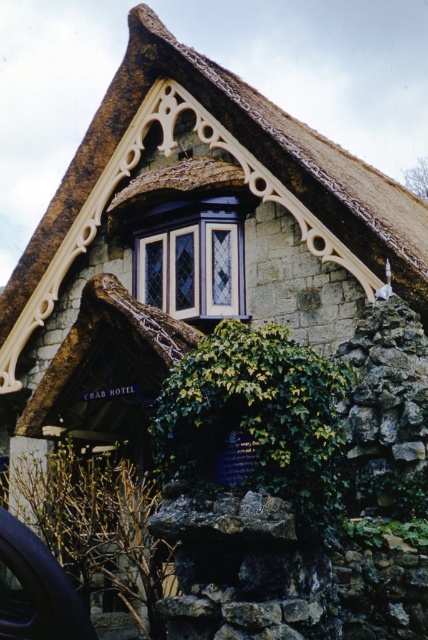
Question: Can you confirm if thatched straw roof at upper center is wider than clear glass window at center?

Choices:
 (A) yes
 (B) no

Answer: (A)

Question: Is thatched straw roof at upper center wider than green leafy ivy at center?

Choices:
 (A) yes
 (B) no

Answer: (A)

Question: Which of the following is the closest to the observer?

Choices:
 (A) thatched straw roof at upper center
 (B) green leafy ivy at center
 (C) clear glass window at center
 (D) shiny black car at lower left

Answer: (D)

Question: Can you confirm if green leafy ivy at center is positioned to the left of clear glass window at center?

Choices:
 (A) yes
 (B) no

Answer: (B)

Question: Which is nearer to the green leafy ivy at center?

Choices:
 (A) shiny black car at lower left
 (B) thatched straw roof at upper center
 (C) clear glass window at center
 (D) transparent glass car window at lower left

Answer: (D)

Question: Which of the following is the closest to the observer?

Choices:
 (A) (14, 605)
 (B) (202, 483)

Answer: (A)